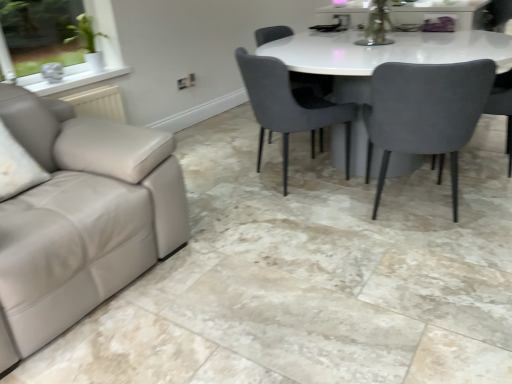
I want to click on free point in front of suede gray chair at right, marked as the 2th chair in a right-to-left arrangement, so (428, 267).